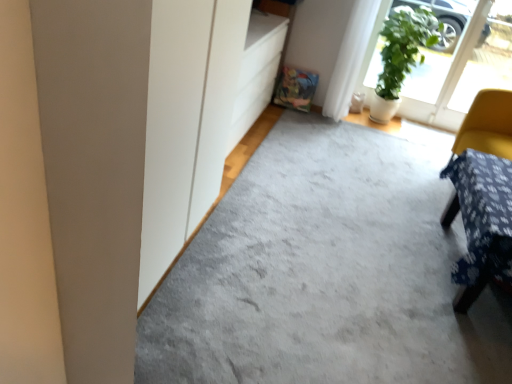
Question: Is transparent glass window at upper right taller or shorter than green leafy plant at upper right?

Choices:
 (A) short
 (B) tall

Answer: (B)

Question: Would you say transparent glass window at upper right is to the left or to the right of green leafy plant at upper right in the picture?

Choices:
 (A) right
 (B) left

Answer: (A)

Question: Which object is positioned farthest from the green leafy plant at upper right?

Choices:
 (A) transparent glass window at upper right
 (B) green matte screen door at upper right
 (C) yellow fabric-covered chair at right
 (D) white fabric curtain at upper right
 (E) blue fabric-covered table at right

Answer: (E)

Question: Based on their relative distances, which object is farther from the white fabric curtain at upper right?

Choices:
 (A) transparent glass window at upper right
 (B) green matte screen door at upper right
 (C) blue fabric-covered table at right
 (D) yellow fabric-covered chair at right
 (E) green leafy plant at upper right

Answer: (C)